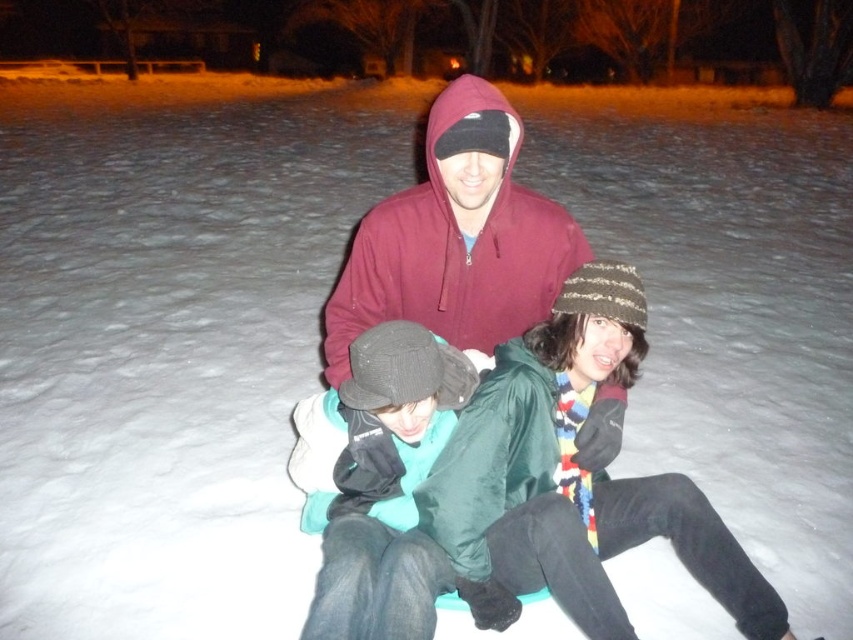
Can you confirm if striped knit beanie at center is bigger than maroon hoodie at center?

Yes, striped knit beanie at center is bigger than maroon hoodie at center.

Does striped knit beanie at center have a smaller size compared to maroon hoodie at center?

No, striped knit beanie at center is not smaller than maroon hoodie at center.

The width and height of the screenshot is (853, 640). In order to click on striped knit beanie at center in this screenshot , I will do `click(572, 477)`.

Find the location of `striped knit beanie at center`. striped knit beanie at center is located at coordinates (572, 477).